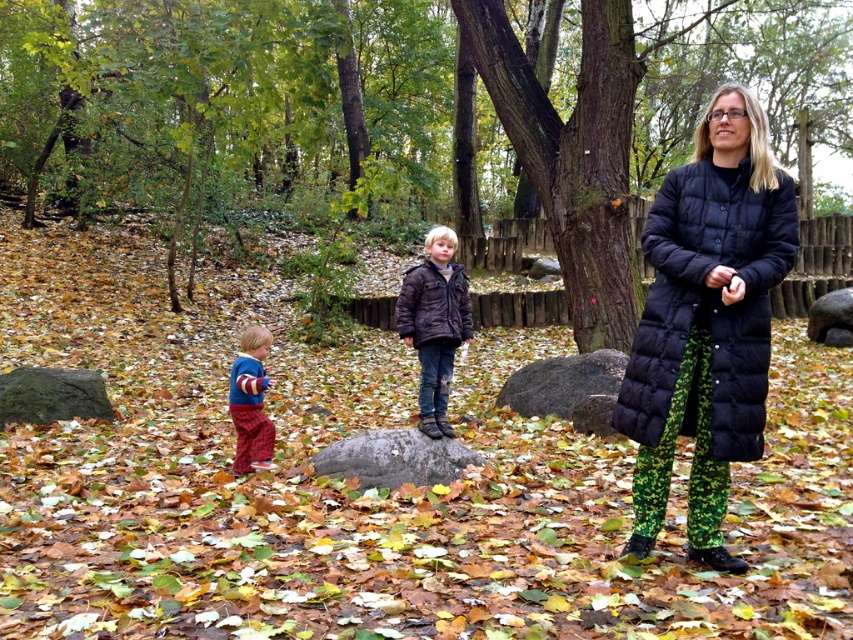
Question: Which point is farther to the camera?

Choices:
 (A) (21, 381)
 (B) (405, 340)

Answer: (A)

Question: Can you confirm if gray rough stone at center is positioned to the left of plaid fabric pants at lower left?

Choices:
 (A) no
 (B) yes

Answer: (A)

Question: In this image, where is brown textured bark at center located relative to gray rough stone at center?

Choices:
 (A) below
 (B) above

Answer: (B)

Question: Which object appears farthest from the camera in this image?

Choices:
 (A) green mossy rock at lower left
 (B) plaid fabric pants at lower left
 (C) gray rough stone at center
 (D) brown textured bark at center

Answer: (D)

Question: Is gray rough stone at center smaller than green mossy rock at lower left?

Choices:
 (A) yes
 (B) no

Answer: (A)

Question: Estimate the real-world distances between objects in this image. Which object is farther from the brown leather jacket at center?

Choices:
 (A) plaid fabric pants at lower left
 (B) brown textured bark at center
 (C) green mossy rock at lower left

Answer: (B)